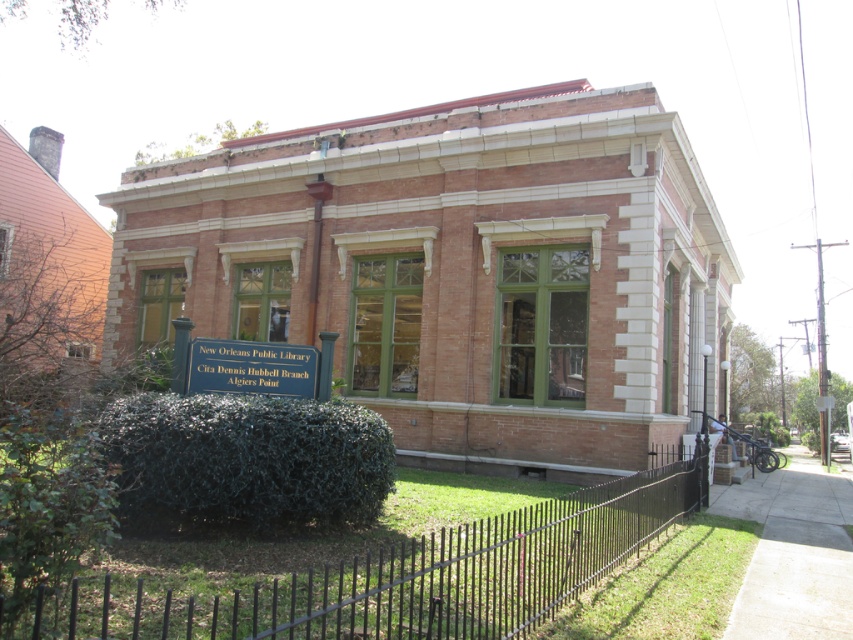
Question: From the image, what is the correct spatial relationship of dark green bush at lower left in relation to metallic silver sign at center?

Choices:
 (A) below
 (B) above

Answer: (A)

Question: Is dark green bush at lower left to the left of metallic silver sign at center from the viewer's perspective?

Choices:
 (A) yes
 (B) no

Answer: (B)

Question: In this image, where is dark green bush at lower left located relative to metallic silver sign at center?

Choices:
 (A) below
 (B) above

Answer: (A)

Question: Which point is farther to the camera?

Choices:
 (A) dark green bush at lower left
 (B) metallic silver sign at center

Answer: (B)

Question: Which of the following is the farthest from the observer?

Choices:
 (A) dark green bush at lower left
 (B) metallic silver sign at center

Answer: (B)